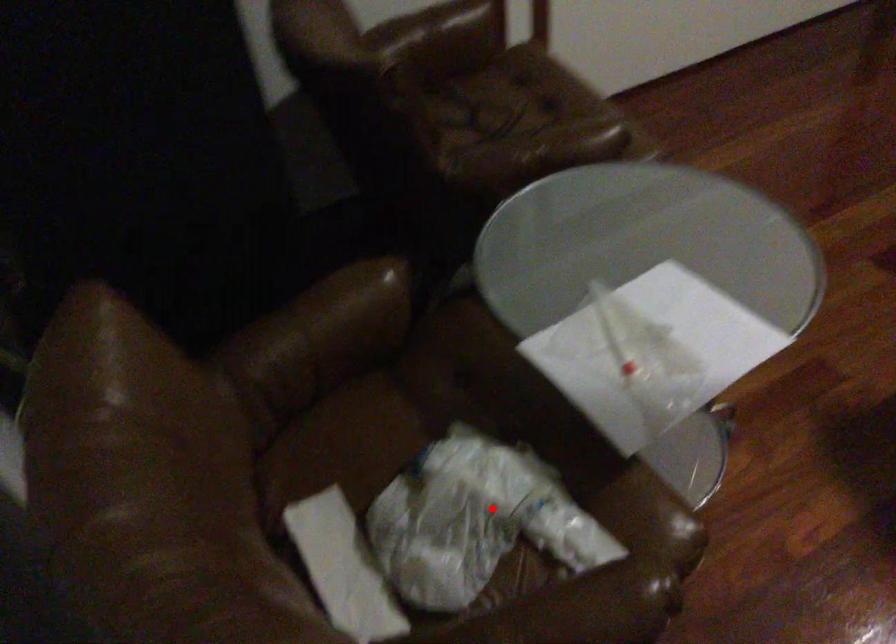
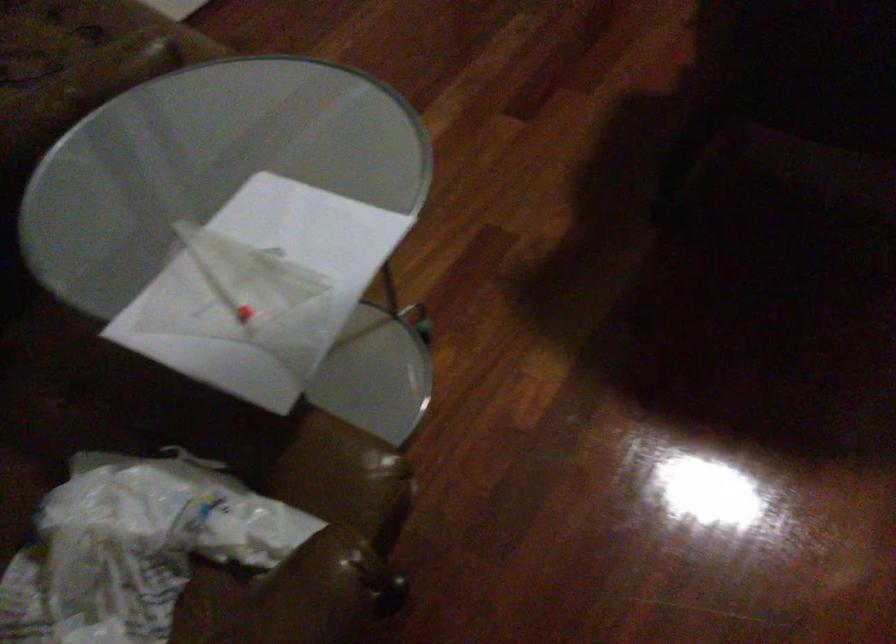
Question: I am providing you with two images of the same scene from different viewpoints. A red point is shown in image1. For the corresponding object point in image2, is it positioned nearer or farther from the camera?

Choices:
 (A) Nearer
 (B) Farther

Answer: (A)